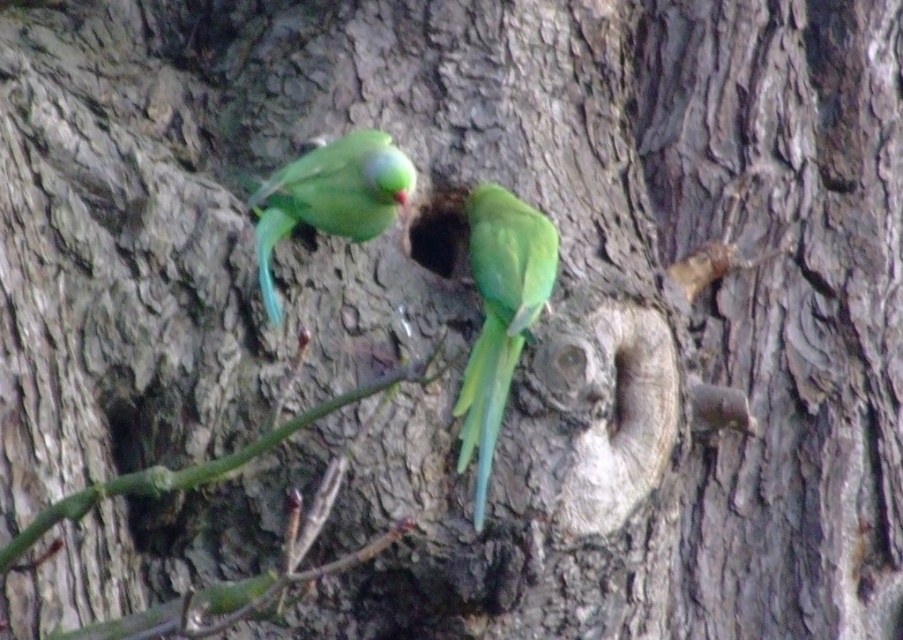
The width and height of the screenshot is (903, 640). Describe the element at coordinates (500, 314) in the screenshot. I see `green matte parrot at center` at that location.

How much distance is there between green matte parrot at center and green glossy parrot at upper center?

green matte parrot at center and green glossy parrot at upper center are 6.81 inches apart.

Image resolution: width=903 pixels, height=640 pixels. I want to click on green matte parrot at center, so click(x=500, y=314).

This screenshot has width=903, height=640. What are the coordinates of `green matte parrot at center` in the screenshot? It's located at (500, 314).

Can you confirm if green glossy parrot at upper center is positioned below green matte branch at lower left?

Actually, green glossy parrot at upper center is above green matte branch at lower left.

Can you confirm if green glossy parrot at upper center is thinner than green matte branch at lower left?

Yes.

The height and width of the screenshot is (640, 903). In order to click on green glossy parrot at upper center in this screenshot , I will do click(330, 196).

Who is more distant from viewer, (486,344) or (21,550)?

Positioned behind is point (486,344).

Does point (499, 314) lie in front of point (262, 451)?

No, it is not.

Where is `green matte parrot at center`? Image resolution: width=903 pixels, height=640 pixels. green matte parrot at center is located at coordinates (500, 314).